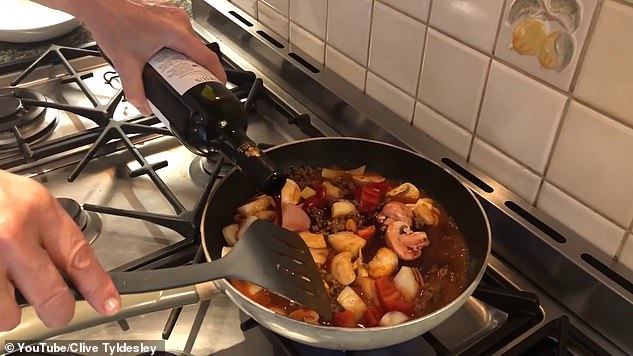
The image size is (633, 356). What are the coordinates of `light gray pan handle` in the screenshot? It's located at (23, 326).